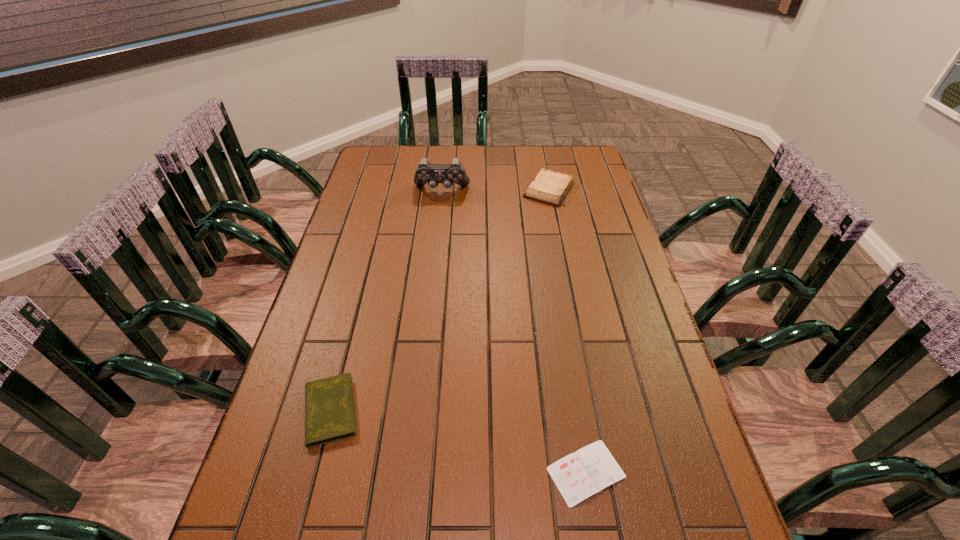
Find the location of a particular element. object that is the third nearest to the tallest object is located at coordinates (579, 475).

Find the location of a particular element. Image resolution: width=960 pixels, height=540 pixels. diary that is the second closest to the shortest diary is located at coordinates (550, 187).

Locate an element on the screen. This screenshot has width=960, height=540. diary identified as the second closest to the third shortest object is located at coordinates (579, 475).

Locate an element on the screen. The image size is (960, 540). free space that satisfies the following two spatial constraints: 1. on the surface of the shortest diary with buttons; 2. on the right side of the tallest object is located at coordinates (411, 472).